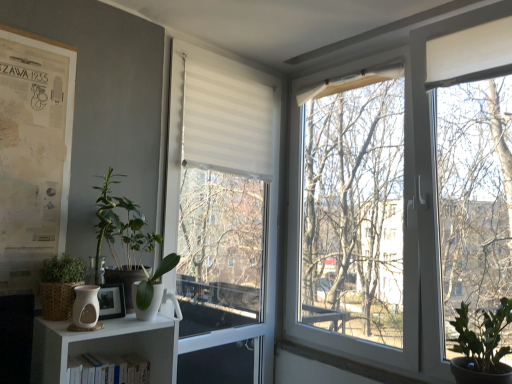
Where is `empty space that is ontop of white matte window at center (from a real-world perspective)`? The image size is (512, 384). empty space that is ontop of white matte window at center (from a real-world perspective) is located at coordinates (227, 57).